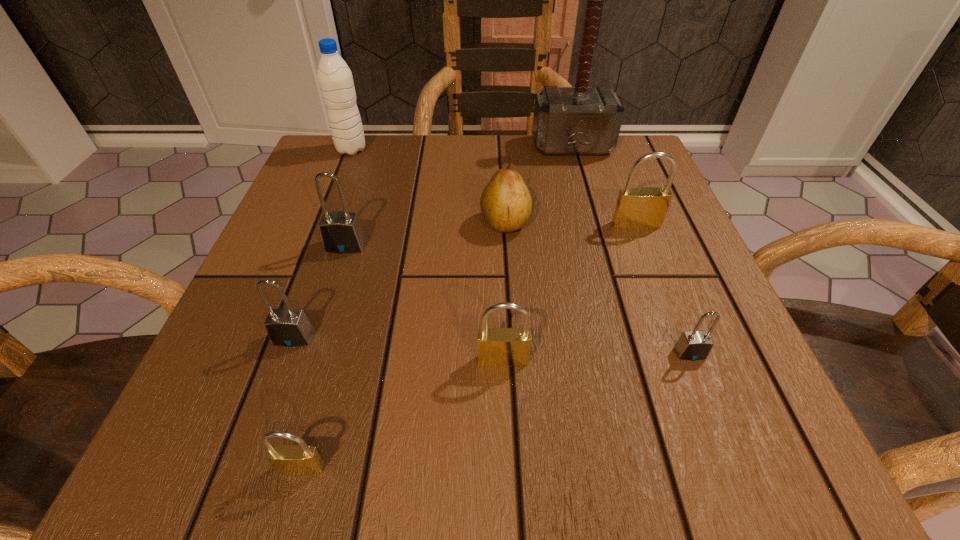
The image size is (960, 540). What are the coordinates of `vacant region located 0.140m on the shackle of the second biggest gray padlock` in the screenshot? It's located at (255, 444).

At what (x,y) coordinates should I click in order to perform the action: click on vacant space located on the shackle of the rightmost gray padlock. Please return your answer as a coordinate pair (x, y). The width and height of the screenshot is (960, 540). Looking at the image, I should click on (714, 415).

The image size is (960, 540). Find the location of `hammer that is at the far edge`. hammer that is at the far edge is located at coordinates (581, 120).

At what (x,y) coordinates should I click in order to perform the action: click on water bottle that is at the far edge. Please return your answer as a coordinate pair (x, y). This screenshot has width=960, height=540. Looking at the image, I should click on (335, 79).

The width and height of the screenshot is (960, 540). What are the coordinates of `object present at the near edge` in the screenshot? It's located at (302, 459).

You are a GUI agent. You are given a task and a screenshot of the screen. Output one action in this format:
    pyautogui.click(x=<x>, y=<y>)
    Task: Click on the water bottle at the left edge
    
    Given the screenshot: What is the action you would take?
    pyautogui.click(x=335, y=79)

This screenshot has width=960, height=540. Find the location of `hammer positioned at the right edge`. hammer positioned at the right edge is located at coordinates (581, 120).

Identify the location of object positioned at the far left corner. (335, 79).

At what (x,y) coordinates should I click in order to perform the action: click on object located at the near left corner. Please return your answer as a coordinate pair (x, y). Looking at the image, I should click on (302, 459).

Find the location of `object that is at the far right corner`. object that is at the far right corner is located at coordinates (581, 120).